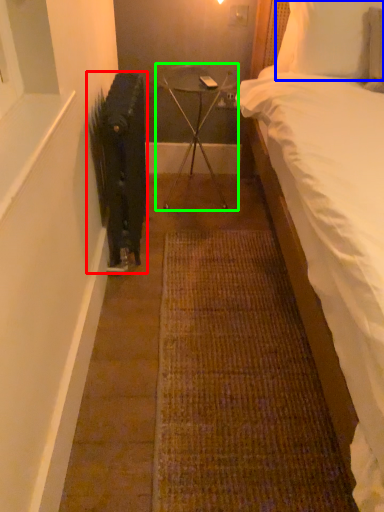
Question: Estimate the real-world distances between objects in this image. Which object is farther from radiator (highlighted by a red box), pillow (highlighted by a blue box) or furniture (highlighted by a green box)?

Choices:
 (A) pillow
 (B) furniture

Answer: (A)